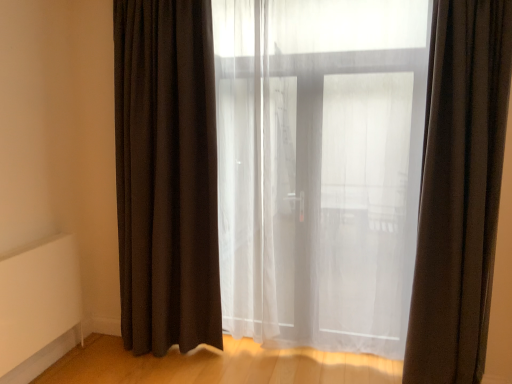
What do you see at coordinates (459, 191) in the screenshot? The image size is (512, 384). I see `dark matte curtain at right` at bounding box center [459, 191].

You are a GUI agent. You are given a task and a screenshot of the screen. Output one action in this format:
    pyautogui.click(x=<x>, y=<y>)
    Task: Click on the dark matte curtain at right
    Image resolution: width=512 pixels, height=384 pixels.
    Given the screenshot: What is the action you would take?
    pyautogui.click(x=459, y=191)

Measure the distance between point (x=478, y=4) and camera.

The depth of point (x=478, y=4) is 2.13 meters.

This screenshot has height=384, width=512. In order to click on dark matte curtain at right in this screenshot , I will do `click(459, 191)`.